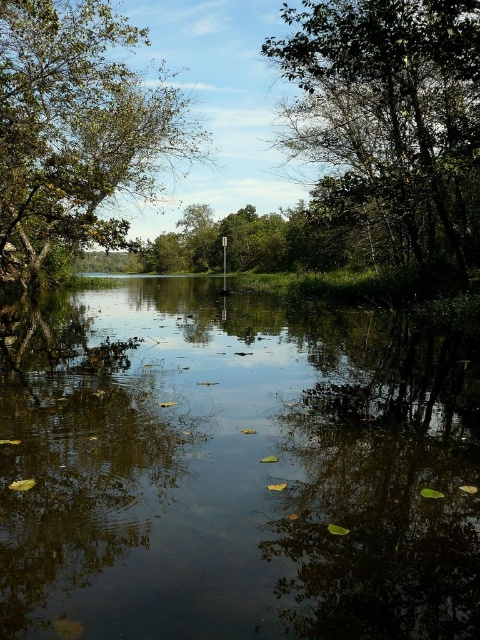
Can you confirm if dark reflective water at center is positioned above green leafy tree at upper left?

Incorrect, dark reflective water at center is not positioned above green leafy tree at upper left.

Is dark reflective water at center bigger than green leafy tree at upper left?

No, dark reflective water at center is not bigger than green leafy tree at upper left.

Does point (286, 540) lie in front of point (121, 166)?

Yes.

Locate an element on the screen. dark reflective water at center is located at coordinates (233, 468).

Between green leafy tree at upper right and green leafy tree at upper left, which one appears on the right side from the viewer's perspective?

Positioned to the right is green leafy tree at upper right.

Between point (295, 74) and point (8, 269), which one is positioned in front?

Point (295, 74) is more forward.

Is point (365, 24) more distant than point (80, 224)?

No, (365, 24) is in front of (80, 224).

This screenshot has height=640, width=480. Find the location of `green leafy tree at upper right`. green leafy tree at upper right is located at coordinates [392, 116].

Is dark reflective water at center thinner than green leafy tree at upper right?

No.

Who is shorter, dark reflective water at center or green leafy tree at upper right?

With less height is dark reflective water at center.

Is point (443, 636) positioned behind point (307, 145)?

That is False.

Locate an element on the screen. The image size is (480, 640). dark reflective water at center is located at coordinates (233, 468).